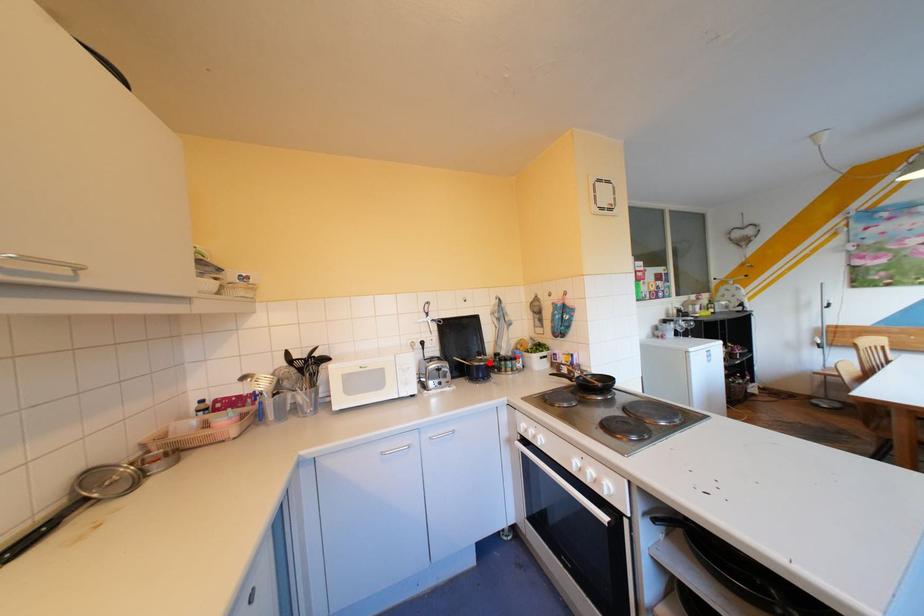
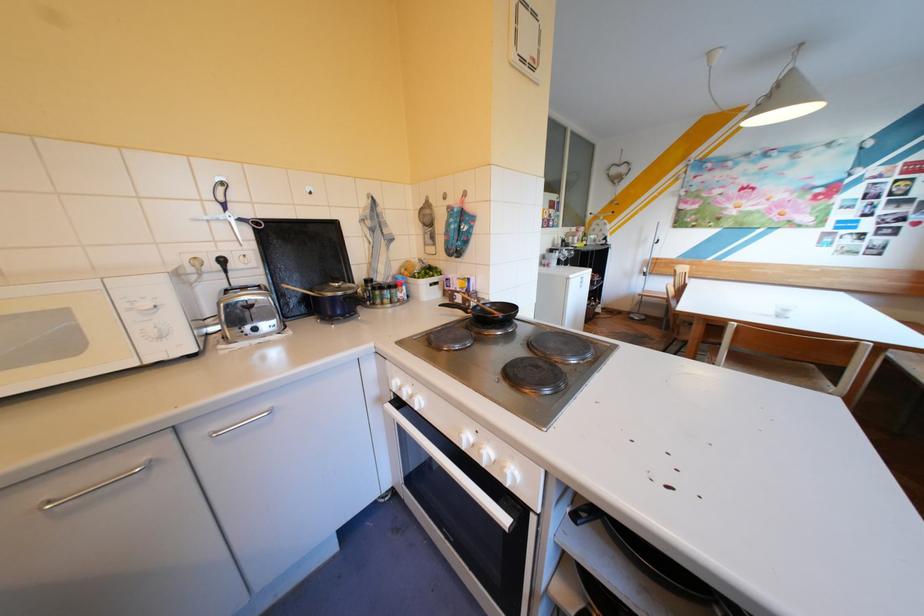
Where in the second image is the point corresponding to the highlighted location from the first image?

(343, 294)